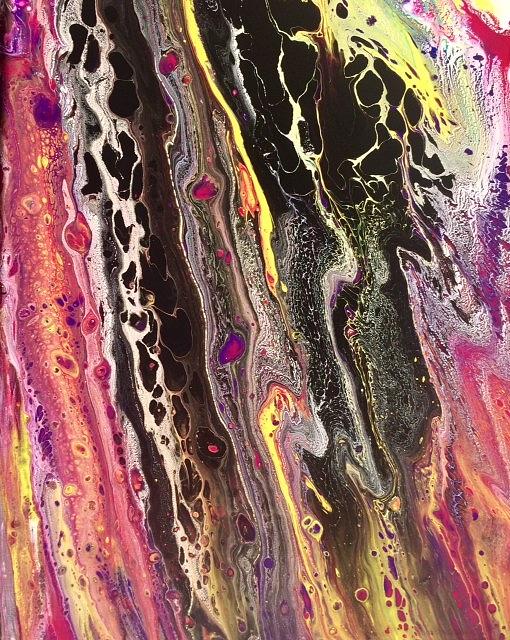
The width and height of the screenshot is (510, 640). What are the coordinates of `pink paint` in the screenshot? It's located at (499, 44), (214, 448), (63, 626).